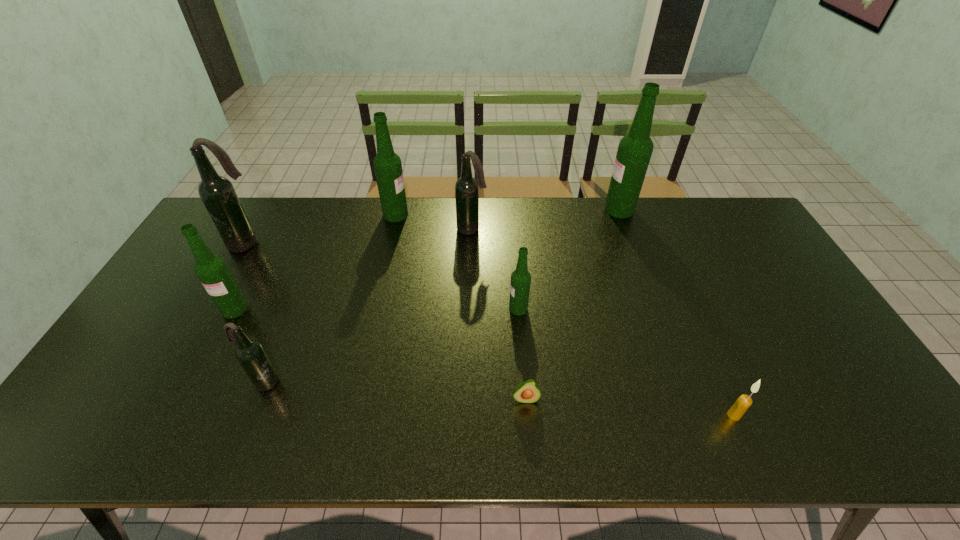
Identify the location of empty space between the shortest object and the leftmost dark beer bottle. This screenshot has width=960, height=540. (386, 321).

This screenshot has width=960, height=540. I want to click on free space that is in between the biggest dark beer bottle and the tallest beer bottle, so click(x=433, y=226).

Locate an element on the screen. The width and height of the screenshot is (960, 540). vacant space in between the third biggest green beer bottle and the leftmost dark beer bottle is located at coordinates (240, 276).

Identify the location of free space that is in between the shortest object and the third biggest green beer bottle. The image size is (960, 540). (380, 354).

Find the location of `free space between the eighth tallest object and the third biggest green beer bottle`. free space between the eighth tallest object and the third biggest green beer bottle is located at coordinates (484, 362).

Locate an element on the screen. This screenshot has width=960, height=540. unoccupied area between the third green beer bottle from right to left and the eighth object from left to right is located at coordinates (508, 212).

Locate an element on the screen. The image size is (960, 540). object that is the fifth closest one to the third beer bottle from right to left is located at coordinates (217, 193).

Identify the location of object that stands as the eighth closest to the eighth object from left to right. (212, 271).

Identify which beer bottle is the fifth closest to the rightmost beer bottle. Please provide its 2D coordinates. Your answer should be formatted as a tuple, i.e. [(x, y)], where the tuple contains the x and y coordinates of a point satisfying the conditions above.

[(217, 193)]

Find the location of a particular element. Image resolution: width=960 pixels, height=540 pixels. the fifth closest beer bottle relative to the second green beer bottle from right to left is located at coordinates (212, 271).